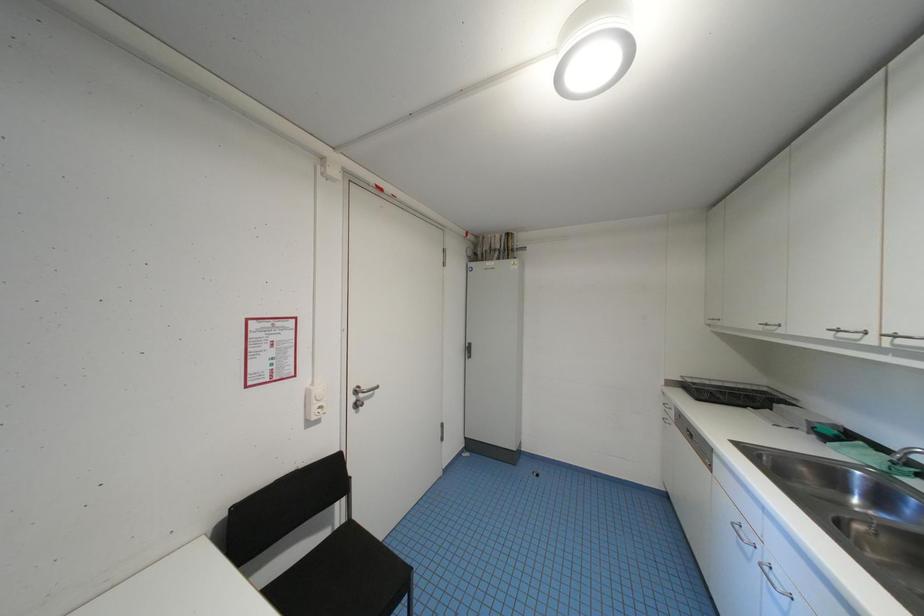
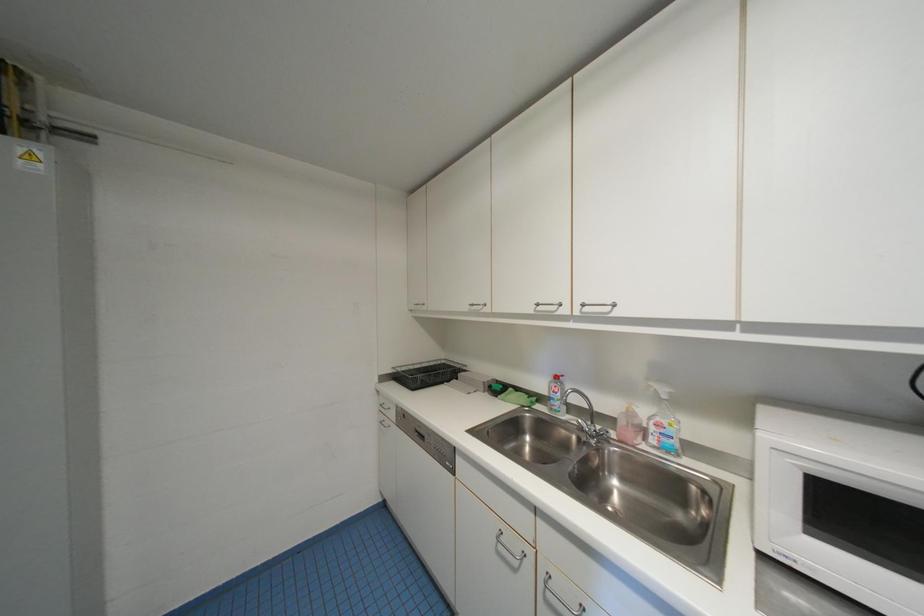
Question: Based on the continuous images, in which direction is the camera rotating? Reply with the corresponding letter.

Choices:
 (A) Left
 (B) Right
 (C) Up
 (D) Down

Answer: (B)